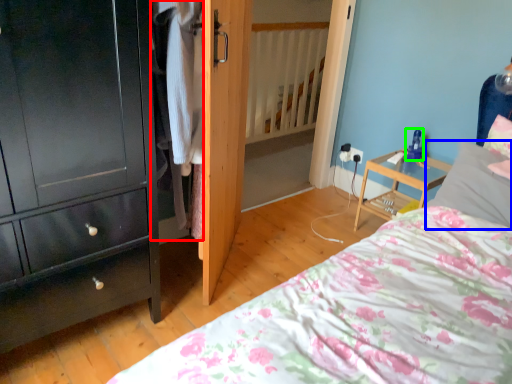
Question: Which is nearer to the clothing (highlighted by a red box)? pillow (highlighted by a blue box) or toy (highlighted by a green box).

Choices:
 (A) pillow
 (B) toy

Answer: (A)